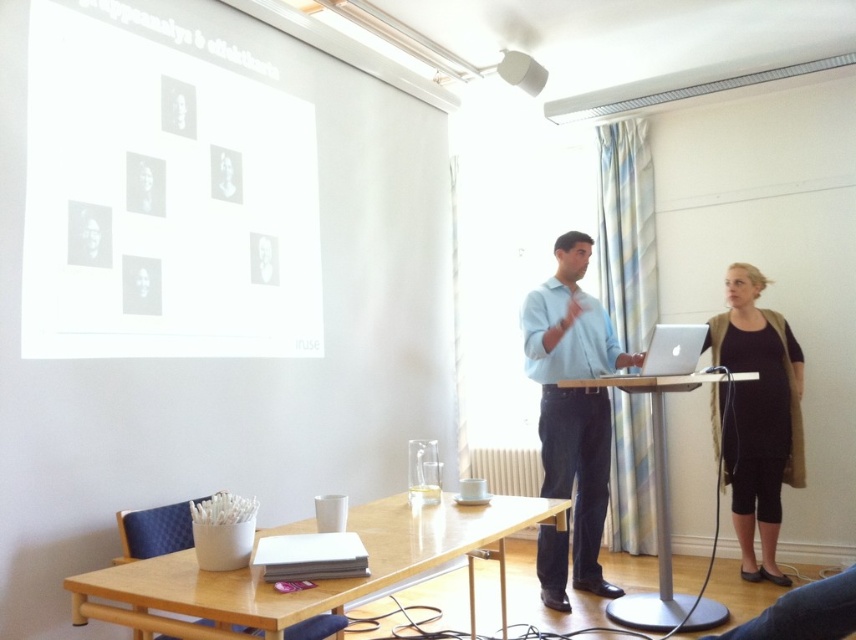
You are an event organizer arranging seating for attendees. You need to place a chair in front of the light blue shirt at center and the black jersey at right. Which chair should be placed further back to ensure both individuals have equal visibility from the audience?

The chair in front of the black jersey at right should be placed further back because the light blue shirt at center has a greater height, so to ensure equal visibility, the shorter individual wearing the black jersey at right needs to be positioned further back.